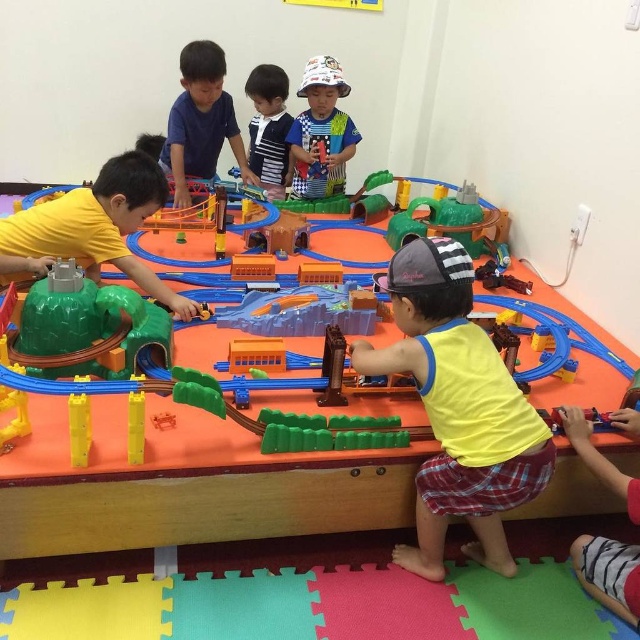
You are a parent trying to choose between two shirts for your child to wear while playing with the toy train set. You notice the matte blue shirt at center and the striped fabric shirt at center. Which shirt would you recommend if you want the child to have more arm movement?

The matte blue shirt at center has a larger width than the striped fabric shirt at center, so it would allow for more arm movement.

You are a parent trying to find a matching pair of shirts for your child. You see a yellow fabric shirt at center and a striped fabric shirt at center. Which shirt is positioned lower on the child?

The yellow fabric shirt at center is located below striped fabric shirt at center, so the yellow fabric shirt at center is positioned lower on the child.

You are a parent trying to decide which shirt to wear for a casual day out. You see the matte blue shirt at center and the striped fabric shirt at center in your closet. Which one is positioned to the left when viewed from the front?

The matte blue shirt at center is positioned to the left of the striped fabric shirt at center when viewed from the front.